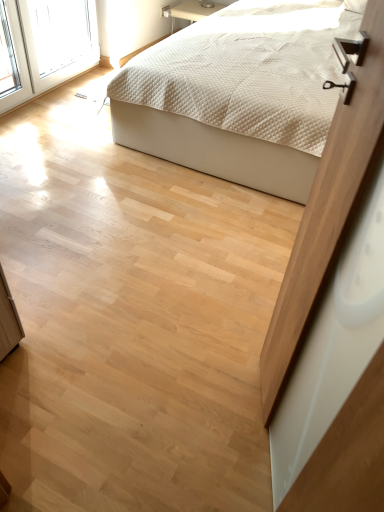
I want to click on vacant space behind matte wood screen door at upper right, so click(x=224, y=332).